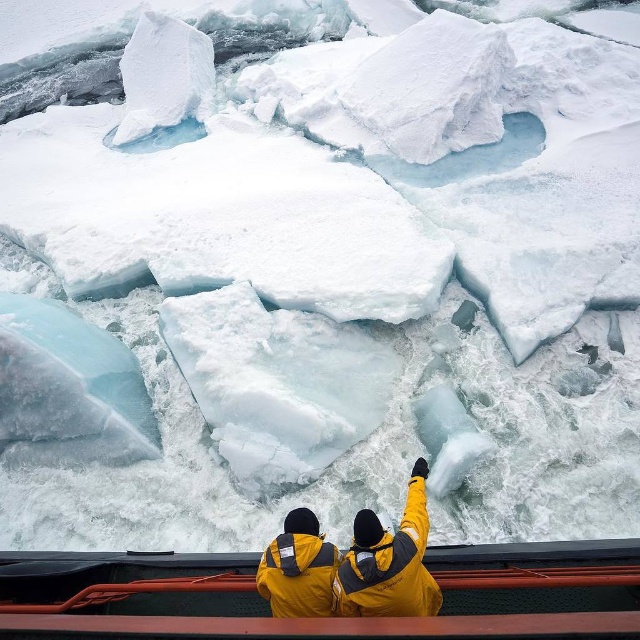
Does yellow matte jacket at center have a lesser height compared to orange metal rail at lower center?

In fact, yellow matte jacket at center may be taller than orange metal rail at lower center.

Who is positioned more to the left, yellow matte jacket at center or orange metal rail at lower center?

From the viewer's perspective, orange metal rail at lower center appears more on the left side.

Identify the location of yellow matte jacket at center. This screenshot has width=640, height=640. (392, 570).

Where is `yellow matte jacket at center`? This screenshot has height=640, width=640. yellow matte jacket at center is located at coordinates (392, 570).

Which is more to the right, orange metal rail at lower center or yellow matte jacket at lower center?

yellow matte jacket at lower center

Can you confirm if orange metal rail at lower center is positioned to the left of yellow matte jacket at lower center?

Correct, you'll find orange metal rail at lower center to the left of yellow matte jacket at lower center.

Does point (20, 605) come in front of point (324, 592)?

No, (20, 605) is further to viewer.

The height and width of the screenshot is (640, 640). I want to click on orange metal rail at lower center, so click(x=540, y=577).

Can you confirm if yellow matte jacket at center is positioned below yellow matte jacket at lower center?

Actually, yellow matte jacket at center is above yellow matte jacket at lower center.

Does yellow matte jacket at center appear on the left side of yellow matte jacket at lower center?

Incorrect, yellow matte jacket at center is not on the left side of yellow matte jacket at lower center.

Who is more forward, [436,595] or [282,545]?

Positioned in front is point [282,545].

I want to click on yellow matte jacket at center, so click(392, 570).